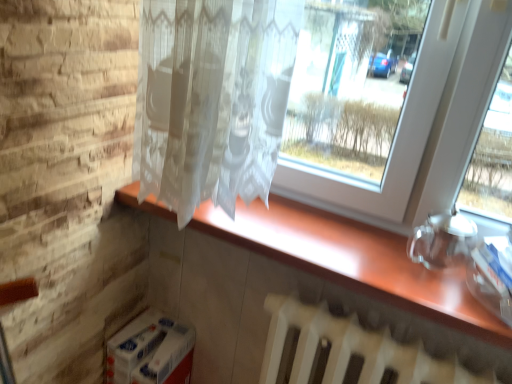
Question: Should I look upward or downward to see wooden counter at center?

Choices:
 (A) up
 (B) down

Answer: (B)

Question: Is white matte radiator at lower center smaller than wooden counter at center?

Choices:
 (A) yes
 (B) no

Answer: (B)

Question: Is white matte radiator at lower center closer to the viewer compared to wooden counter at center?

Choices:
 (A) no
 (B) yes

Answer: (B)

Question: From a real-world perspective, is white matte radiator at lower center positioned under wooden counter at center based on gravity?

Choices:
 (A) yes
 (B) no

Answer: (A)

Question: Can you see white matte radiator at lower center touching wooden counter at center?

Choices:
 (A) no
 (B) yes

Answer: (A)

Question: From a real-world perspective, is white matte radiator at lower center on top of wooden counter at center?

Choices:
 (A) no
 (B) yes

Answer: (A)

Question: Considering the relative sizes of white matte radiator at lower center and wooden counter at center in the image provided, is white matte radiator at lower center shorter than wooden counter at center?

Choices:
 (A) no
 (B) yes

Answer: (A)

Question: Is white matte radiator at lower center at the back of wooden counter at center?

Choices:
 (A) yes
 (B) no

Answer: (B)

Question: Is wooden counter at center beside white matte radiator at lower center?

Choices:
 (A) yes
 (B) no

Answer: (B)

Question: Is white matte radiator at lower center inside wooden counter at center?

Choices:
 (A) yes
 (B) no

Answer: (B)

Question: Can you confirm if wooden counter at center is positioned to the right of white matte radiator at lower center?

Choices:
 (A) yes
 (B) no

Answer: (B)

Question: From the image's perspective, is wooden counter at center beneath white matte radiator at lower center?

Choices:
 (A) no
 (B) yes

Answer: (A)

Question: Considering the relative sizes of wooden counter at center and white matte radiator at lower center in the image provided, is wooden counter at center bigger than white matte radiator at lower center?

Choices:
 (A) no
 (B) yes

Answer: (A)

Question: Is wooden counter at center bigger or smaller than white matte radiator at lower center?

Choices:
 (A) small
 (B) big

Answer: (A)